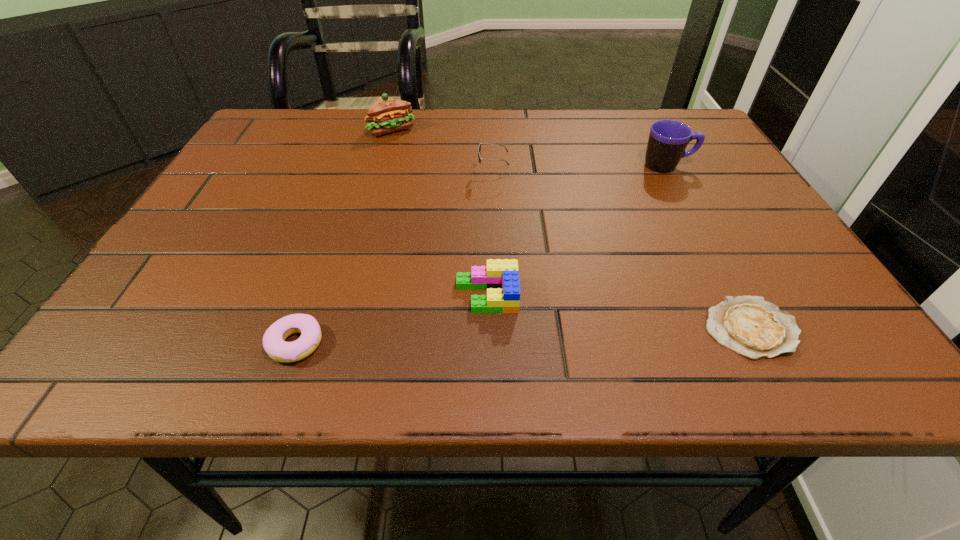
This screenshot has width=960, height=540. In order to click on sandwich in this screenshot , I will do `click(386, 115)`.

Locate an element on the screen. The image size is (960, 540). mug is located at coordinates (668, 139).

Identify the location of sunglasses. (479, 147).

Find the location of a particular element. the fourth tallest object is located at coordinates (500, 278).

This screenshot has width=960, height=540. What are the coordinates of `the fifth tallest object` in the screenshot? It's located at (274, 343).

I want to click on quiche, so click(x=752, y=327).

At what (x,y) coordinates should I click in order to perform the action: click on free space located on the front of the farthest object. Please return your answer as a coordinate pair (x, y). This screenshot has width=960, height=540. Looking at the image, I should click on (383, 163).

You are a GUI agent. You are given a task and a screenshot of the screen. Output one action in this format:
    pyautogui.click(x=<x>, y=<y>)
    Task: Click on the free space located in front of the lenses of the sunglasses
    The height and width of the screenshot is (540, 960).
    Given the screenshot: What is the action you would take?
    pyautogui.click(x=451, y=174)

Locate an element on the screen. vacant region located in front of the lenses of the sunglasses is located at coordinates (451, 174).

Locate an element on the screen. free space located in front of the lenses of the sunglasses is located at coordinates (338, 174).